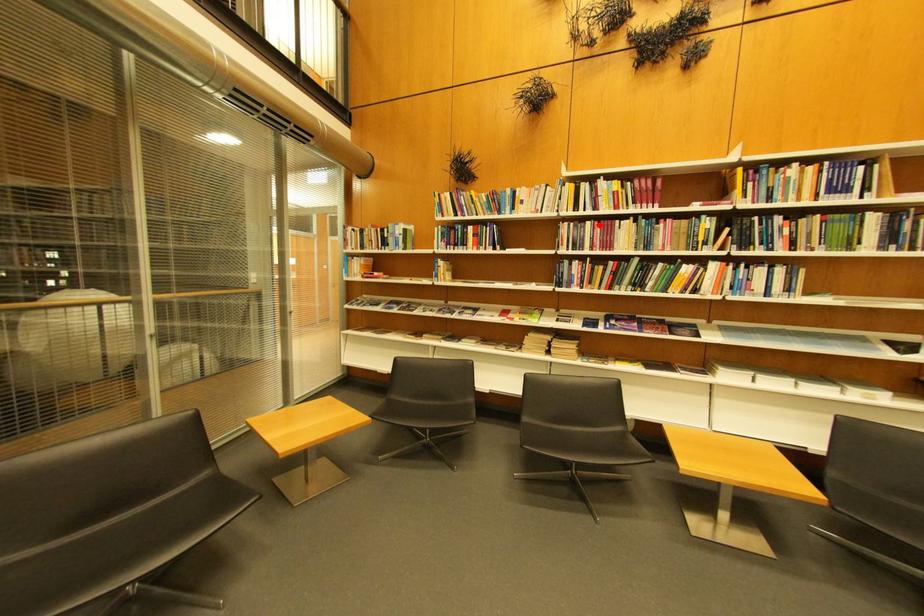
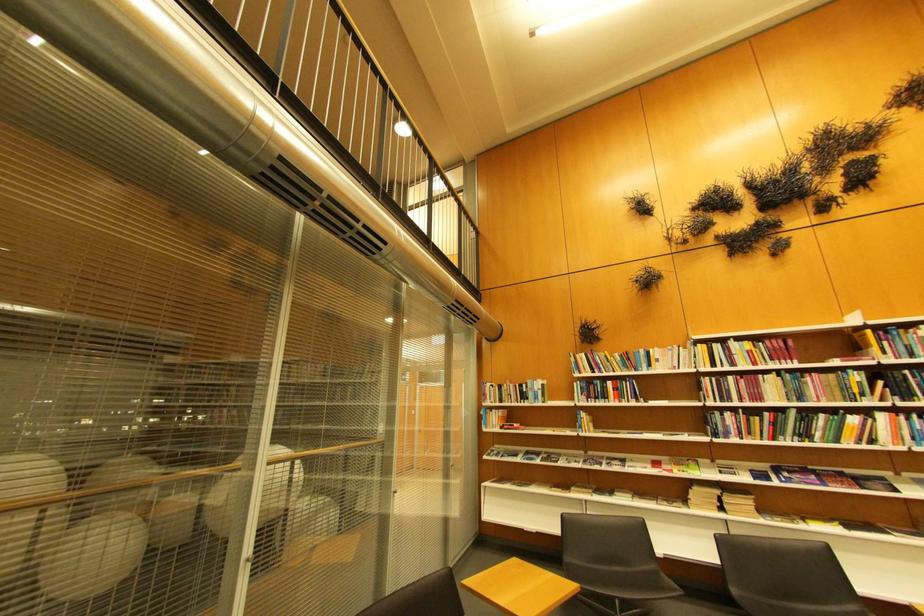
Find the pixel in the second image that matches the highlighted location in the first image.

(740, 379)